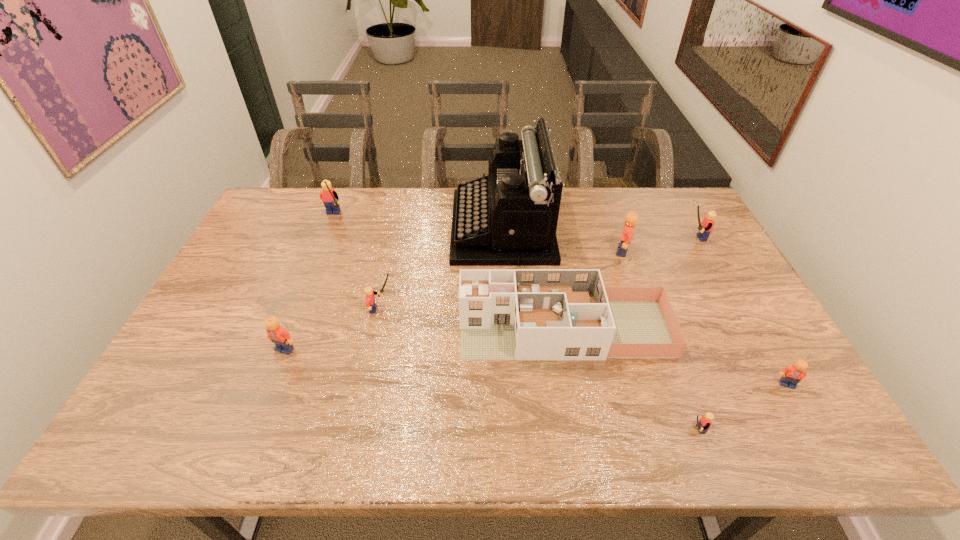
Locate an element on the screen. typewriter is located at coordinates (508, 218).

I want to click on black typewriter, so click(508, 218).

The image size is (960, 540). I want to click on the farthest yellow Lego, so click(x=328, y=196).

In order to click on the tallest Lego in this screenshot , I will do `click(328, 196)`.

You are a GUI agent. You are given a task and a screenshot of the screen. Output one action in this format:
    pyautogui.click(x=<x>, y=<y>)
    Task: Click on the second orange Lego from left to right
    The image size is (960, 540).
    Given the screenshot: What is the action you would take?
    pyautogui.click(x=631, y=218)

Find the location of a particular element. The image size is (960, 540). the biggest orange Lego is located at coordinates (631, 218).

Identify the location of the second farthest yellow Lego. (705, 227).

Where is `the third smallest yellow Lego`? the third smallest yellow Lego is located at coordinates (705, 227).

You are a GUI agent. You are given a task and a screenshot of the screen. Output one action in this format:
    pyautogui.click(x=<x>, y=<y>)
    Task: Click on the dollhouse
    This screenshot has width=960, height=540.
    Given the screenshot: What is the action you would take?
    pyautogui.click(x=505, y=314)

Locate an element on the screen. This screenshot has height=540, width=960. the second farthest orange Lego is located at coordinates (277, 334).